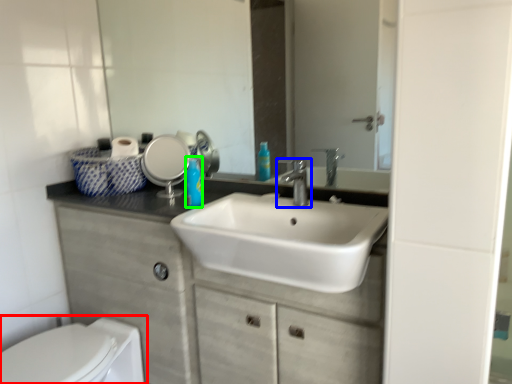
Question: Which object is the closest to the toilet (highlighted by a red box)? Choose among these: tap (highlighted by a blue box) or soap dispenser (highlighted by a green box).

Choices:
 (A) tap
 (B) soap dispenser

Answer: (B)